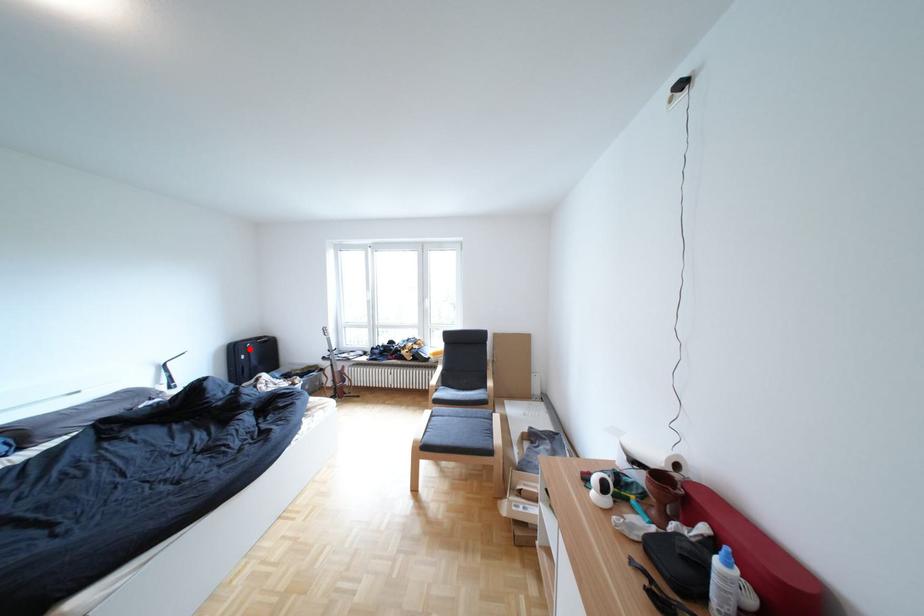
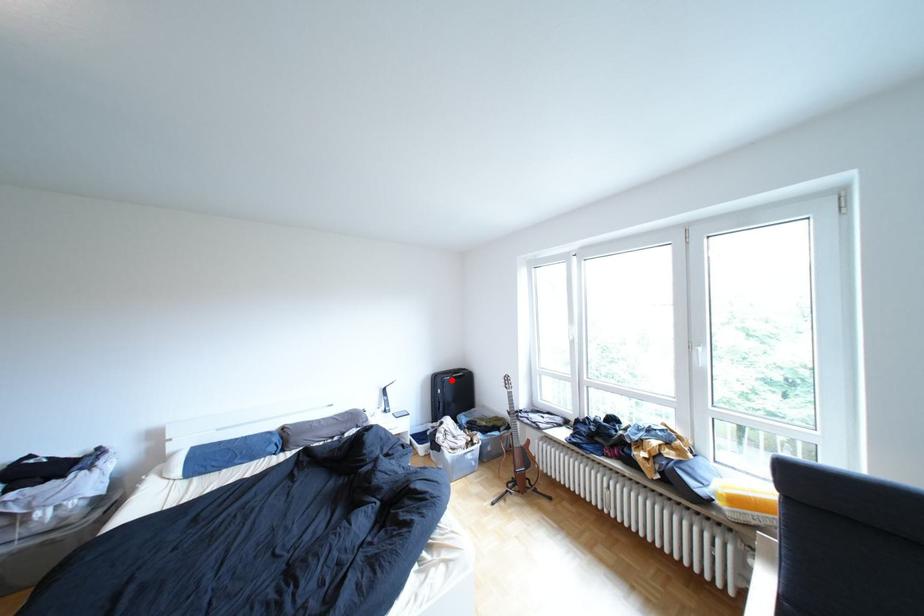
I am providing you with two images of the same scene from different viewpoints. A red point is marked on the first image and another point is marked on the second image. Is the marked point in image1 the same physical position as the marked point in image2?

Yes